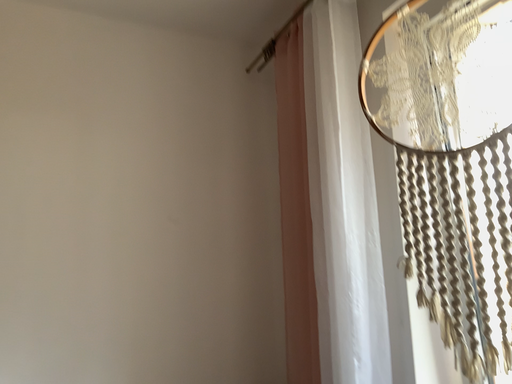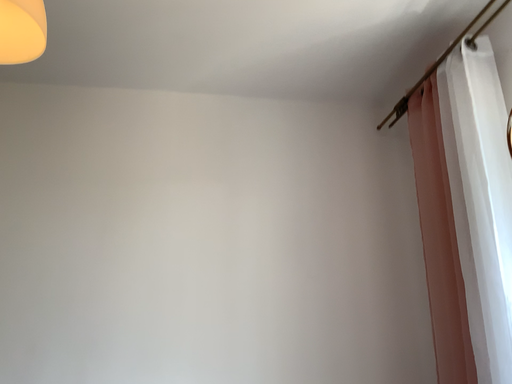
Question: How did the camera likely rotate when shooting the video?

Choices:
 (A) rotated right
 (B) rotated left

Answer: (B)